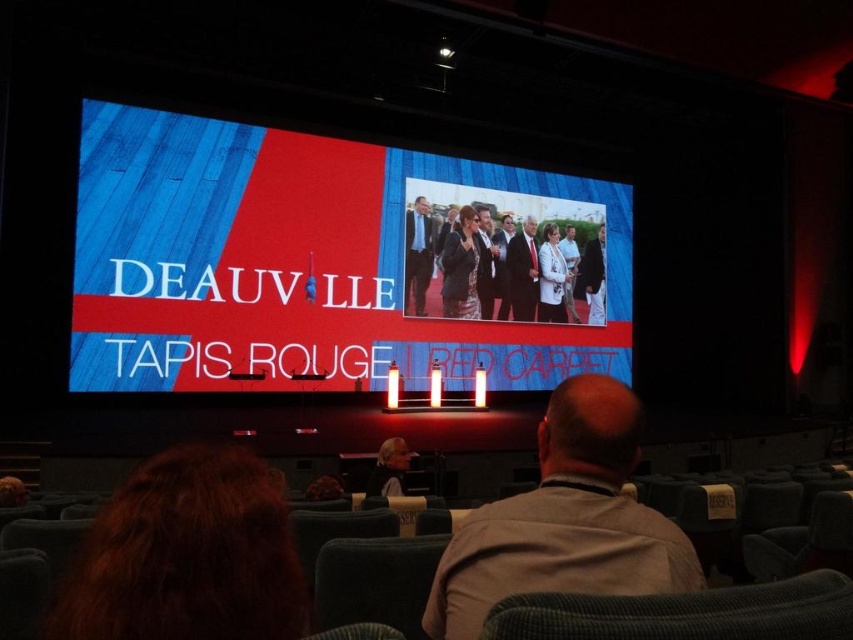
You are a photographer positioned at the back of the theater. You need to capture a photo of both the dark gray suit at center and the white textured dress at center. Considering their sizes, which one should you zoom in on to ensure both fit in the frame?

The dark gray suit at center is wider than the white textured dress at center, so you should zoom out to include both in the frame rather than zooming in.

You are an event organizer who needs to place a 0.5 meters wide decorative stand in the theater. The stand must be placed exactly at the position of the dark blue suit at center. Is there enough space to place the stand without overlapping any other objects?

The position of dark blue suit at center is at point (418, 253). Since no other objects are mentioned in the scene description, there is enough space to place the stand without overlapping any other objects.

You are an attendee at the event and want to take a photo of both the dark blue suit at center and the white textured dress at center. Since you can only focus on one at a time, which one should you position your camera to face first to capture both in the frame?

The dark blue suit at center is to the left of white textured dress at center, so you should position your camera to face the dark blue suit at center first as it is on the left side, allowing the white textured dress at center to be included in the same frame when centered.